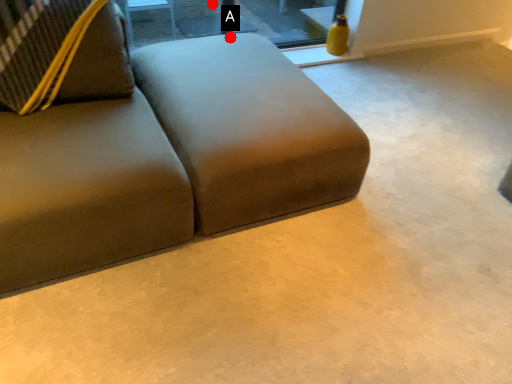
Question: Two points are circled on the image, labeled by A and B beside each circle. Which of the following is the closest to the observer?

Choices:
 (A) A is closer
 (B) B is closer

Answer: (A)